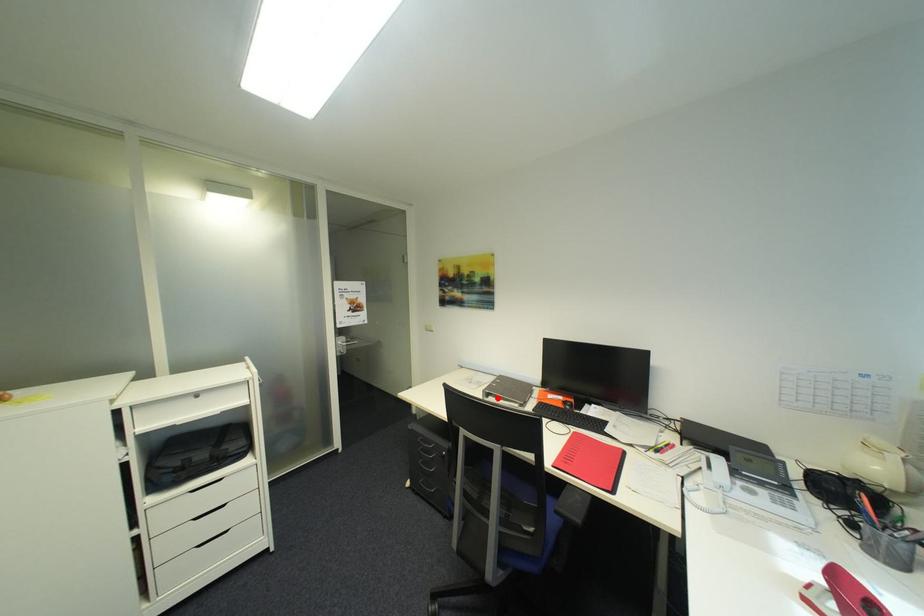
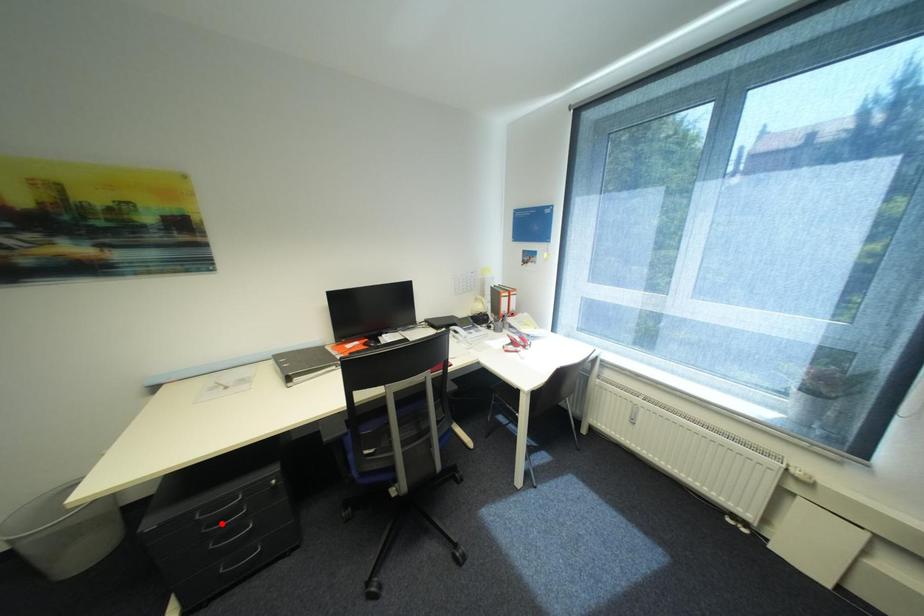
Consider the image. I am providing you with two images of the same scene from different viewpoints. A red point is marked on the first image and another point is marked on the second image. Is the red point in image1 aligned with the point shown in image2?

No